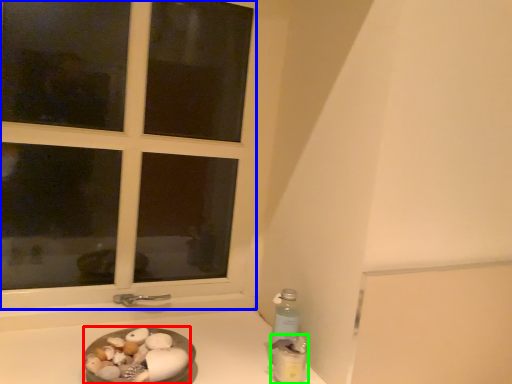
Question: Based on their relative distances, which object is nearer to food (highlighted by a red box)? Choose from window (highlighted by a blue box) and bottle (highlighted by a green box).

Choices:
 (A) window
 (B) bottle

Answer: (B)